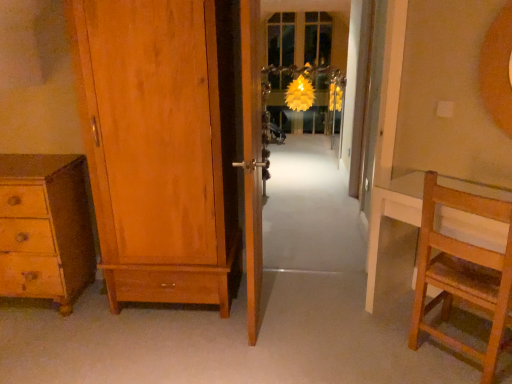
Find the location of `free point behind light brown wooden chair at right`. free point behind light brown wooden chair at right is located at coordinates [428, 313].